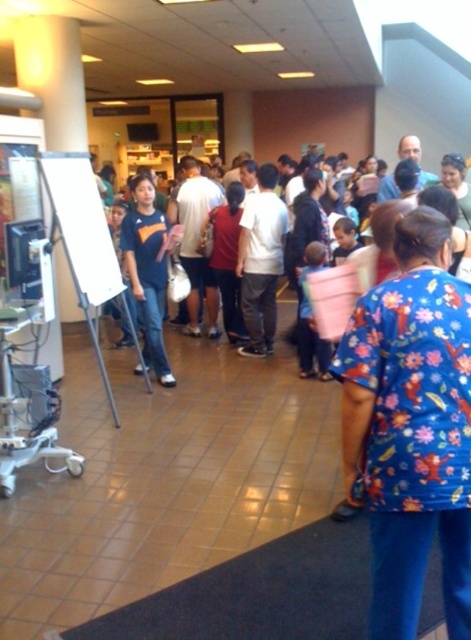
You are a visitor in a healthcare facility and see two people at the center of the scene. One is wearing floral print scrubs at center and the other is wearing a matte blue shirt at center. Which one is positioned more to the right side?

The floral print scrubs at center is positioned to the right of the matte blue shirt at center, so the floral print scrubs at center is more to the right side.

You are standing in the waiting area of a healthcare facility and see the point marked at coordinates (x=411, y=426). What object is located at this point?

The point at coordinates (x=411, y=426) corresponds to the floral print scrubs at center.